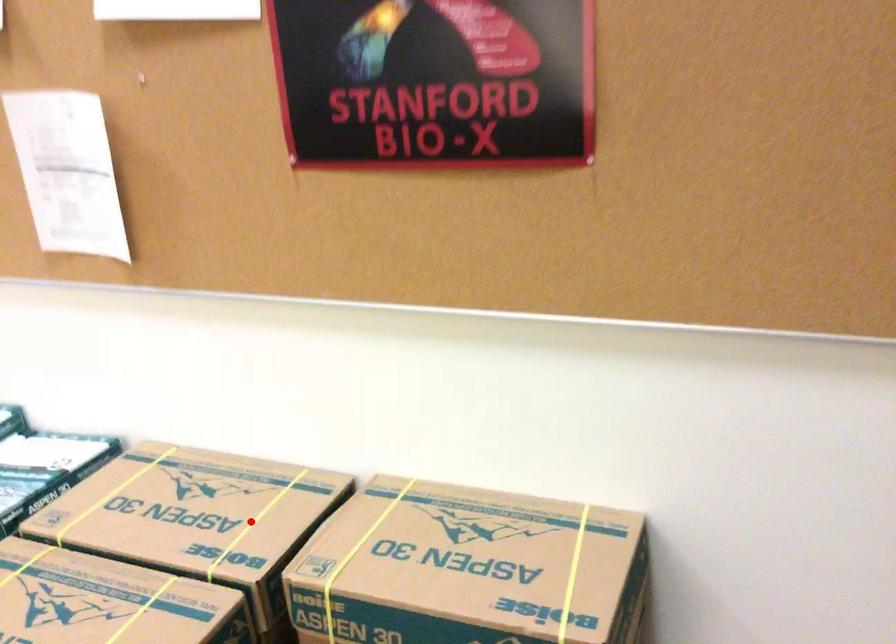
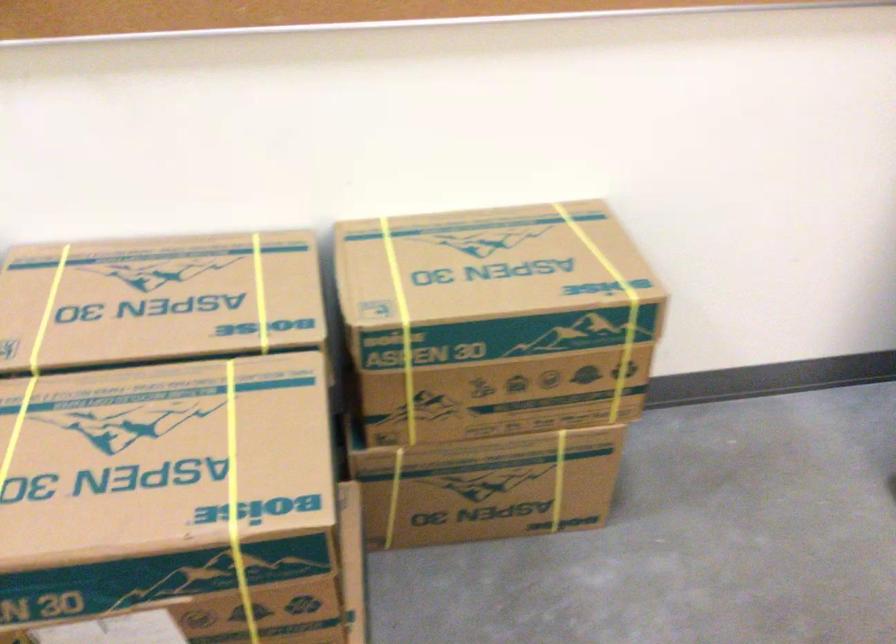
Question: I am providing you with two images of the same scene from different viewpoints. A red point is shown in image1. For the corresponding object point in image2, is it positioned nearer or farther from the camera?

Choices:
 (A) Nearer
 (B) Farther

Answer: (A)